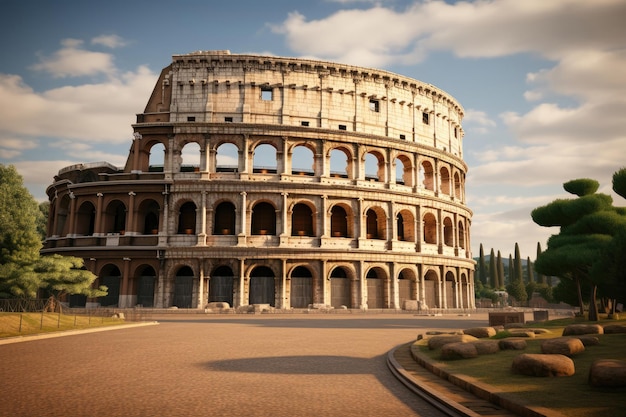
Where is `bench`? The height and width of the screenshot is (417, 626). bench is located at coordinates (515, 316).